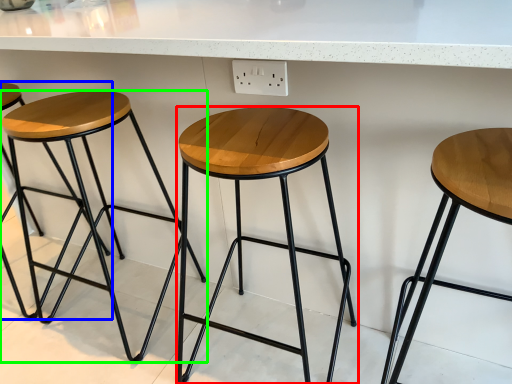
Question: Which object is the closest to the stool (highlighted by a red box)? Choose among these: stool (highlighted by a blue box) or stool (highlighted by a green box).

Choices:
 (A) stool
 (B) stool

Answer: (B)